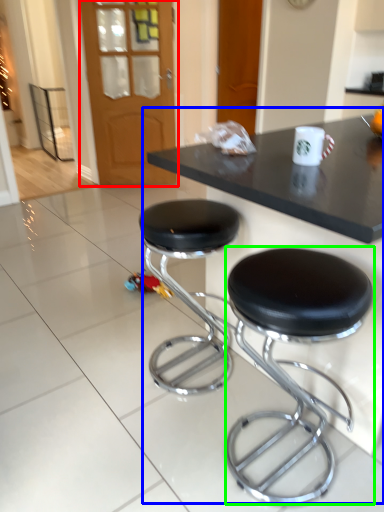
Question: Considering the real-world distances, which object is farthest from glass door (highlighted by a red box)? table (highlighted by a blue box) or stool (highlighted by a green box)?

Choices:
 (A) table
 (B) stool

Answer: (B)